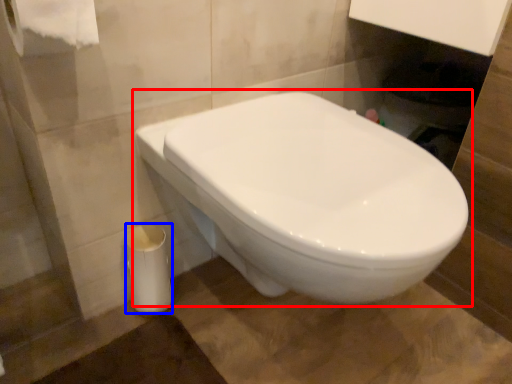
Question: Which point is closer to the camera, toilet (highlighted by a red box) or porcelain (highlighted by a blue box)?

Choices:
 (A) toilet
 (B) porcelain

Answer: (A)